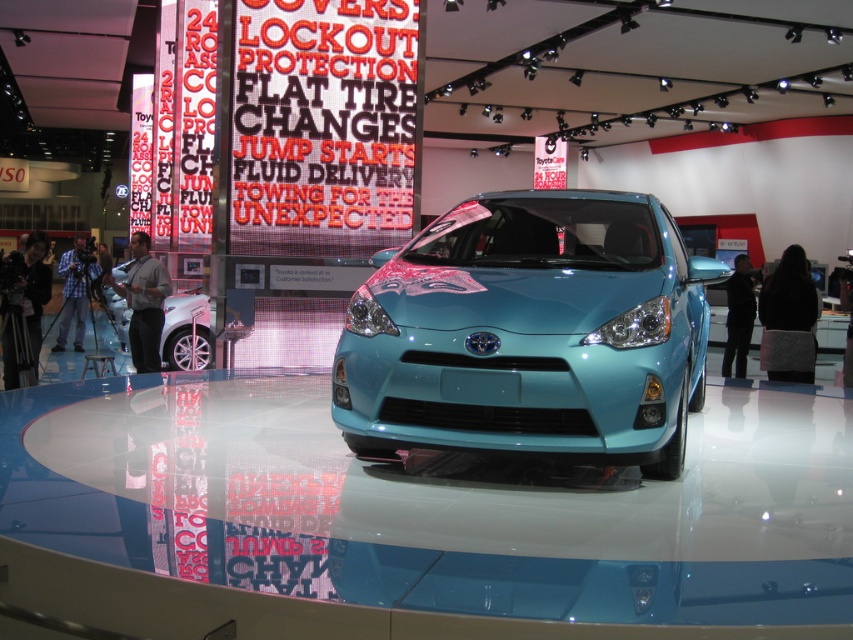
Is teal glossy concept car at center to the left of matte black car at left from the viewer's perspective?

Incorrect, teal glossy concept car at center is not on the left side of matte black car at left.

Which is behind, point (616, 227) or point (125, 275)?

Point (125, 275)

Where is `teal glossy concept car at center`? teal glossy concept car at center is located at coordinates (531, 333).